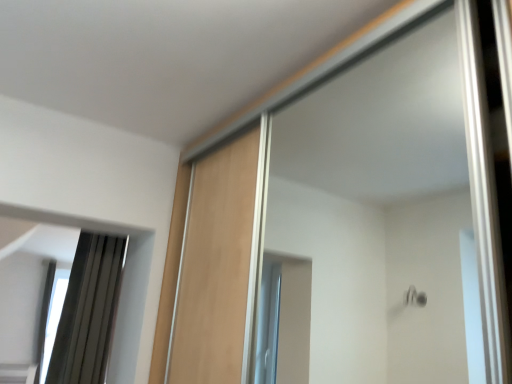
Where is `matte gray curtain at left`? This screenshot has height=384, width=512. matte gray curtain at left is located at coordinates (122, 284).

Describe the element at coordinates (122, 284) in the screenshot. I see `matte gray curtain at left` at that location.

Find the location of a particular element. This screenshot has height=384, width=512. transparent glass window at lower left is located at coordinates [53, 317].

The image size is (512, 384). What do you see at coordinates (53, 317) in the screenshot?
I see `transparent glass window at lower left` at bounding box center [53, 317].

In order to face transparent glass window at lower left, should I rotate leftwards or rightwards?

To align with it, rotate left about 26.011°.

The width and height of the screenshot is (512, 384). What are the coordinates of `matte gray curtain at left` in the screenshot? It's located at (122, 284).

Which object is positioned more to the left, matte gray curtain at left or transparent glass window at lower left?

transparent glass window at lower left.

From the picture: Is the position of matte gray curtain at left less distant than that of transparent glass window at lower left?

Yes, matte gray curtain at left is closer to the viewer.

Which is further, (x=118, y=359) or (x=48, y=316)?

The point (x=48, y=316) is farther from the camera.

From the image's perspective, is matte gray curtain at left over transparent glass window at lower left?

Yes.

From a real-world perspective, does matte gray curtain at left stand above transparent glass window at lower left?

Yes, from a real-world perspective, matte gray curtain at left is above transparent glass window at lower left.

Considering the sizes of objects matte gray curtain at left and transparent glass window at lower left in the image provided, who is thinner, matte gray curtain at left or transparent glass window at lower left?

Thinner between the two is matte gray curtain at left.

Between matte gray curtain at left and transparent glass window at lower left, which one has less height?

Standing shorter between the two is matte gray curtain at left.

From the picture: Which of these two, matte gray curtain at left or transparent glass window at lower left, is bigger?

With larger size is transparent glass window at lower left.

Can transparent glass window at lower left be found inside matte gray curtain at left?

No, transparent glass window at lower left is not surrounded by matte gray curtain at left.

Consider the image. Is matte gray curtain at left directly adjacent to transparent glass window at lower left?

matte gray curtain at left is not next to transparent glass window at lower left, and they're not touching.

Is matte gray curtain at left facing towards transparent glass window at lower left?

Yes, matte gray curtain at left faces towards transparent glass window at lower left.

Measure the distance between matte gray curtain at left and transparent glass window at lower left.

matte gray curtain at left and transparent glass window at lower left are 17.14 inches apart.

There is a transparent glass window at lower left. In order to click on mirror above it (from a real-world perspective) in this screenshot , I will do `click(122, 284)`.

Between transparent glass window at lower left and matte gray curtain at left, which one appears on the left side from the viewer's perspective?

From the viewer's perspective, transparent glass window at lower left appears more on the left side.

Does transparent glass window at lower left lie behind matte gray curtain at left?

Yes, transparent glass window at lower left is further from the camera.

Which point is more distant from viewer, (62,281) or (144,242)?

The point (62,281) is farther from the camera.

From the image's perspective, would you say transparent glass window at lower left is shown under matte gray curtain at left?

Answer: Indeed, from the image's perspective, transparent glass window at lower left is shown beneath matte gray curtain at left.

From a real-world perspective, is transparent glass window at lower left positioned above or below matte gray curtain at left?

transparent glass window at lower left is situated lower than matte gray curtain at left in the real world.

Looking at this image, can you confirm if transparent glass window at lower left is thinner than matte gray curtain at left?

No, transparent glass window at lower left is not thinner than matte gray curtain at left.

Can you confirm if transparent glass window at lower left is taller than matte gray curtain at left?

Indeed, transparent glass window at lower left has a greater height compared to matte gray curtain at left.

From the picture: Between transparent glass window at lower left and matte gray curtain at left, which one has smaller size?

With smaller size is matte gray curtain at left.

Is transparent glass window at lower left spatially inside matte gray curtain at left, or outside of it?

transparent glass window at lower left cannot be found inside matte gray curtain at left.

Would you consider transparent glass window at lower left to be distant from matte gray curtain at left?

Actually, transparent glass window at lower left and matte gray curtain at left are a little close together.

Is transparent glass window at lower left oriented towards matte gray curtain at left?

No, transparent glass window at lower left is not facing towards matte gray curtain at left.

Measure the distance from transparent glass window at lower left to matte gray curtain at left.

A distance of 43.54 centimeters exists between transparent glass window at lower left and matte gray curtain at left.

Identify the location of window below the matte gray curtain at left (from the image's perspective). (53, 317).

The width and height of the screenshot is (512, 384). In order to click on mirror in front of the transparent glass window at lower left in this screenshot , I will do `click(122, 284)`.

At what (x,y) coordinates should I click in order to perform the action: click on window that appears below the matte gray curtain at left (from a real-world perspective). Please return your answer as a coordinate pair (x, y). Image resolution: width=512 pixels, height=384 pixels. Looking at the image, I should click on click(x=53, y=317).